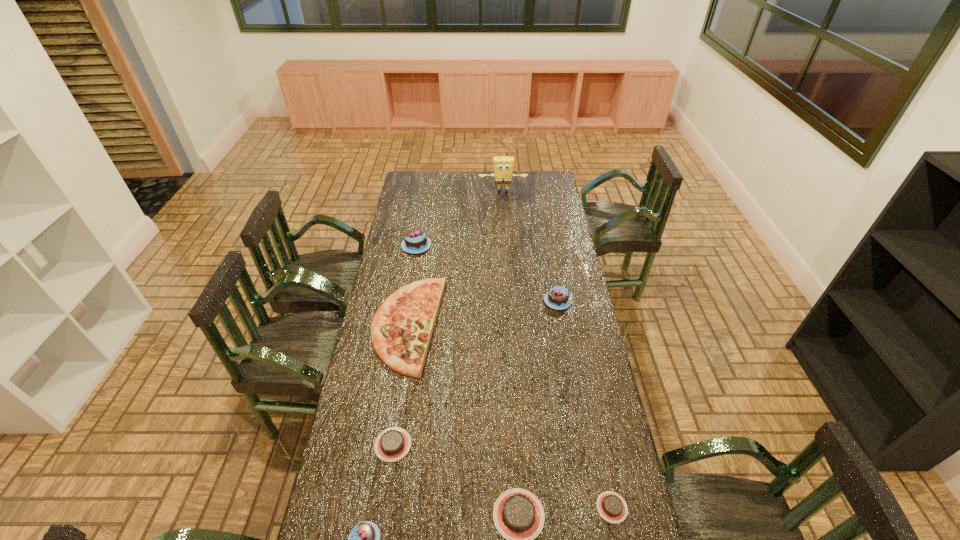
Image resolution: width=960 pixels, height=540 pixels. Find the location of `the farthest object`. the farthest object is located at coordinates (503, 166).

Where is `the tallest object`? the tallest object is located at coordinates (503, 166).

Locate an element on the screen. the farthest pink chocolate cake is located at coordinates coord(415,241).

The height and width of the screenshot is (540, 960). Find the location of `the second tallest object`. the second tallest object is located at coordinates (415, 241).

Identify the location of the second farthest chocolate cake. (558, 298).

Where is `the second tallest chocolate cake`? the second tallest chocolate cake is located at coordinates (558, 298).

Image resolution: width=960 pixels, height=540 pixels. I want to click on pizza, so click(401, 330).

Image resolution: width=960 pixels, height=540 pixels. I want to click on the fourth nearest chocolate cake, so click(392, 444).

This screenshot has height=540, width=960. I want to click on the fourth nearest object, so click(392, 444).

The height and width of the screenshot is (540, 960). I want to click on the shortest chocolate cake, so click(611, 506).